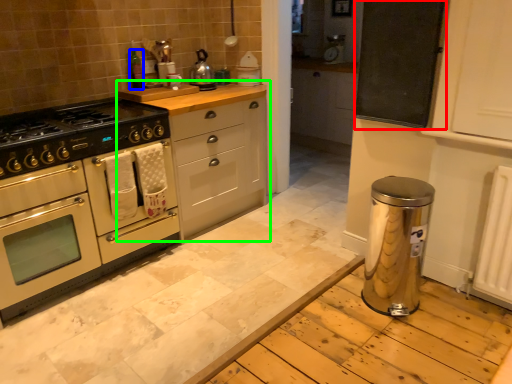
Question: Based on their relative distances, which object is farther from bulletin board (highlighted by a red box)? Choose from bottle (highlighted by a blue box) and cabinetry (highlighted by a green box).

Choices:
 (A) bottle
 (B) cabinetry

Answer: (A)